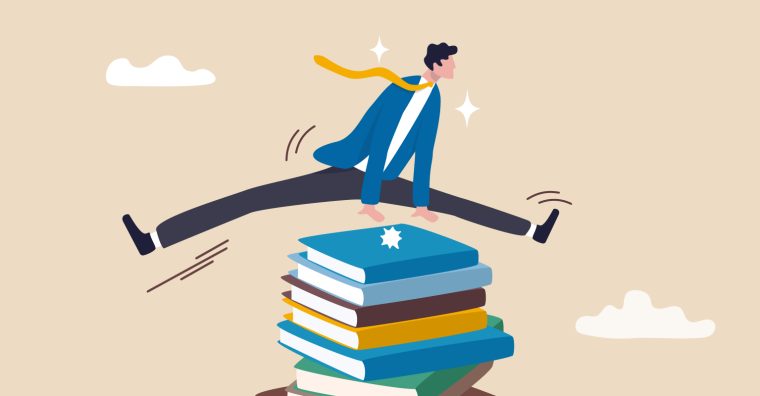
The image size is (760, 396). In order to click on book in this screenshot , I will do `click(385, 268)`, `click(384, 293)`, `click(388, 314)`, `click(394, 335)`, `click(448, 349)`, `click(442, 373)`, `click(464, 376)`, `click(277, 390)`.